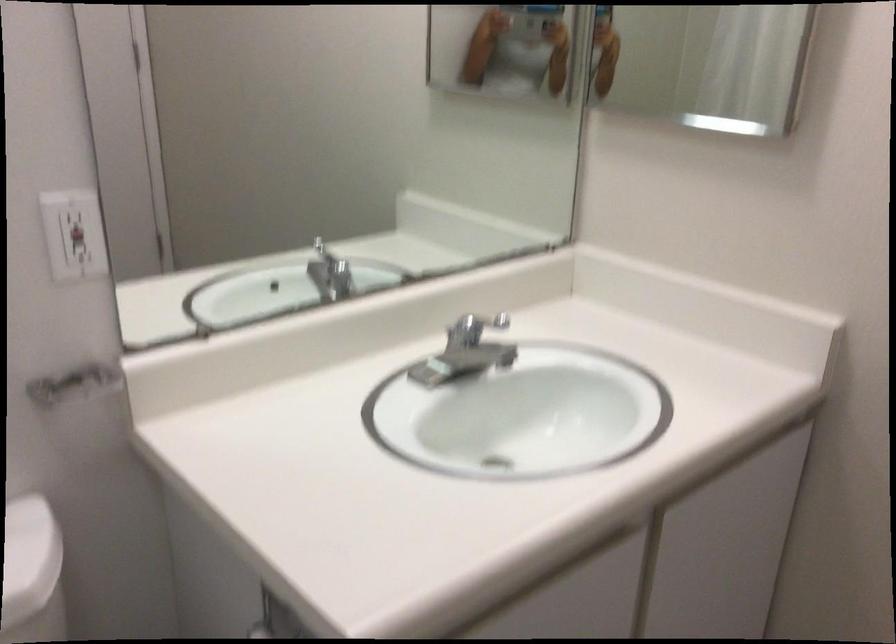
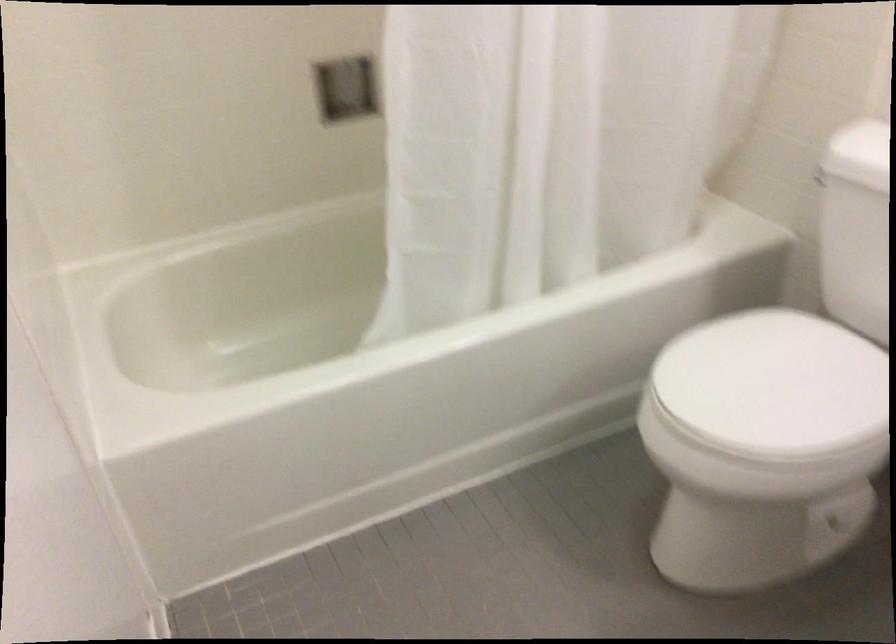
The first image is from the beginning of the video and the second image is from the end. How did the camera likely rotate when shooting the video?

The camera rotated toward left-down.